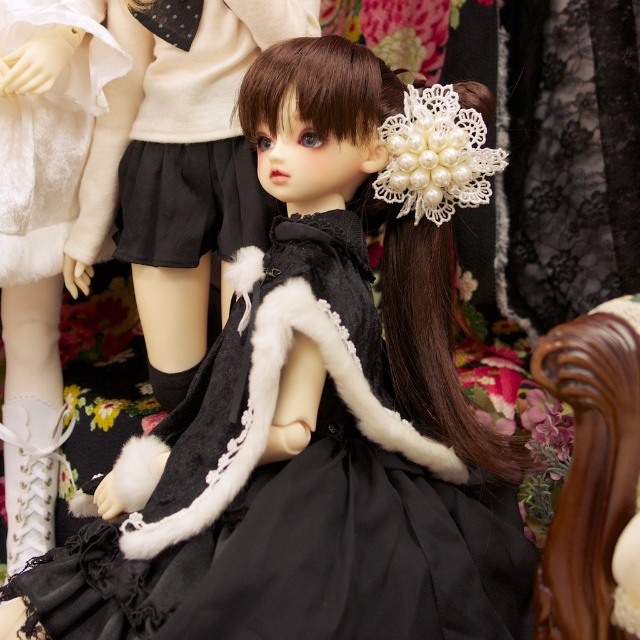
Who is positioned more to the right, brown polished wood chair at right or black matte skirt at upper left?

brown polished wood chair at right

Who is taller, brown polished wood chair at right or black matte skirt at upper left?

black matte skirt at upper left

Describe the element at coordinates (593, 476) in the screenshot. I see `brown polished wood chair at right` at that location.

The height and width of the screenshot is (640, 640). In order to click on brown polished wood chair at right in this screenshot , I will do `click(593, 476)`.

Is point (620, 593) positioned in front of point (28, 172)?

Yes, it is in front of point (28, 172).

Which is above, brown polished wood chair at right or white satin dress at upper left?

white satin dress at upper left

Does point (593, 364) come closer to viewer compared to point (17, 170)?

Yes, point (593, 364) is in front of point (17, 170).

The height and width of the screenshot is (640, 640). In order to click on brown polished wood chair at right in this screenshot , I will do `click(593, 476)`.

Is white fur boots at lower left smaller than black matte skirt at upper left?

No, white fur boots at lower left is not smaller than black matte skirt at upper left.

Is white fur boots at lower left wider than black matte skirt at upper left?

In fact, white fur boots at lower left might be narrower than black matte skirt at upper left.

Which is in front, point (44, 90) or point (262, 3)?

Point (44, 90) is in front.

This screenshot has width=640, height=640. Identify the location of white fur boots at lower left. (40, 234).